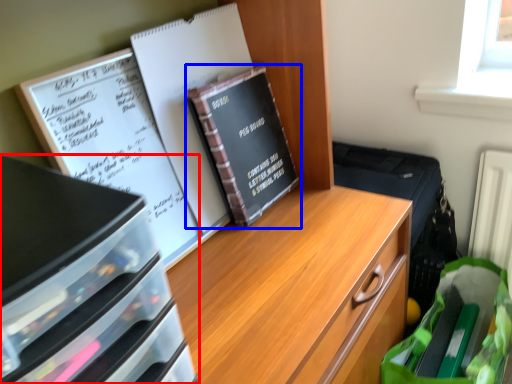
Question: Which point is closer to the camera, desk (highlighted by a red box) or book (highlighted by a blue box)?

Choices:
 (A) desk
 (B) book

Answer: (A)